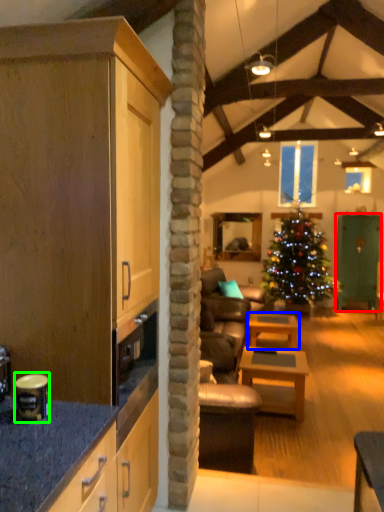
Question: Which is nearer to the glass door (highlighted by a red box)? table (highlighted by a blue box) or appliance (highlighted by a green box).

Choices:
 (A) table
 (B) appliance

Answer: (A)